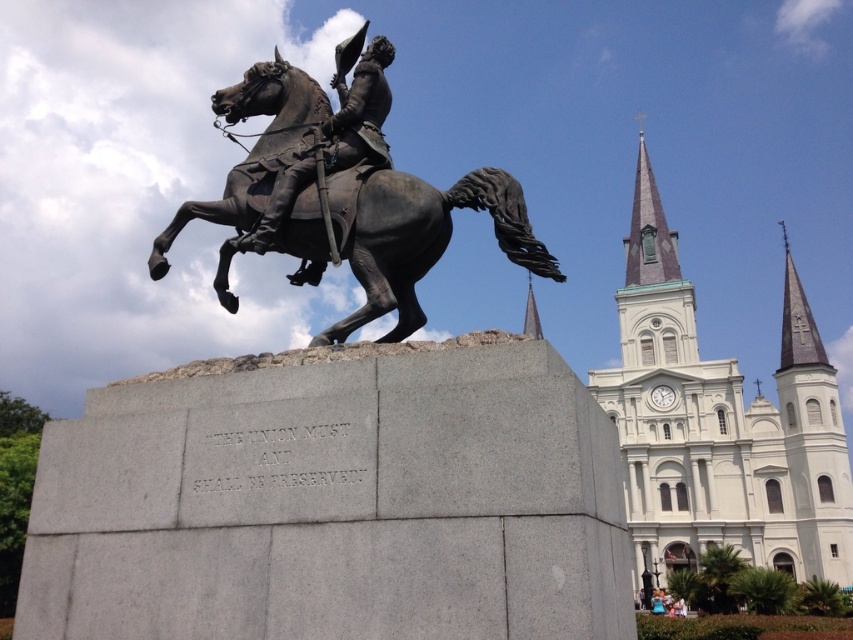
Question: In this image, where is white stone church at upper right located relative to bronze/statue at center?

Choices:
 (A) left
 (B) right

Answer: (B)

Question: Which is nearer to the white stone church at upper right?

Choices:
 (A) bronze statue at center
 (B) bronze/statue at center

Answer: (B)

Question: Among these points, which one is farthest from the camera?

Choices:
 (A) (299, 172)
 (B) (756, 483)
 (C) (390, 198)

Answer: (B)

Question: Can you confirm if white stone church at upper right is positioned to the left of bronze statue at center?

Choices:
 (A) no
 (B) yes

Answer: (A)

Question: Which object appears closest to the camera in this image?

Choices:
 (A) bronze statue at center
 (B) white stone church at upper right

Answer: (A)

Question: Can you confirm if bronze/statue at center is thinner than bronze statue at center?

Choices:
 (A) yes
 (B) no

Answer: (B)